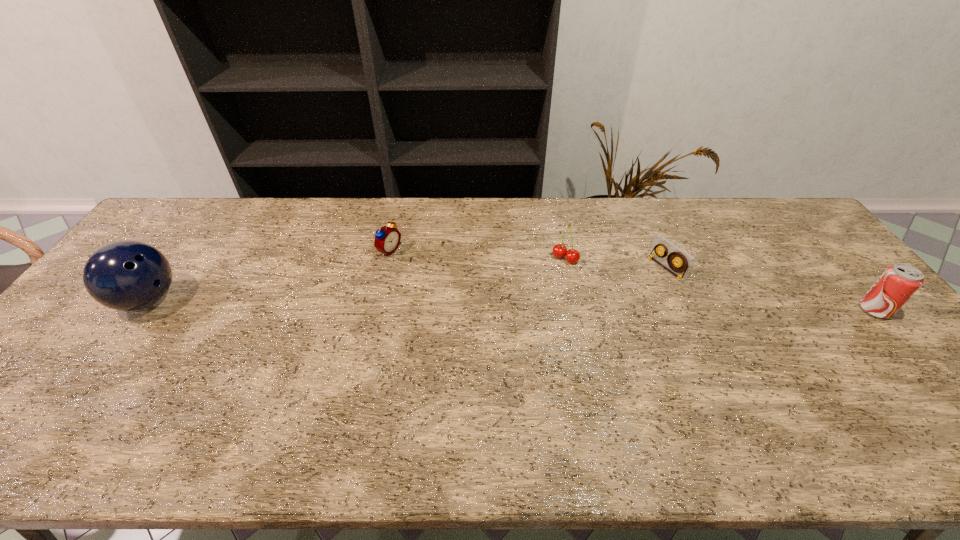
This screenshot has height=540, width=960. I want to click on free spot on the desktop that is between the leftmost object and the rightmost object and is positioned on the front-facing side of the alarm clock, so click(x=505, y=305).

Identify the location of free space on the desktop that is between the leftmost object and the soda can and is positioned with the stems of the cherry pointing upwards. This screenshot has width=960, height=540. (528, 305).

Find the location of a particular element. This screenshot has width=960, height=540. vacant space on the desktop that is between the bowling ball and the fourth shortest object and is positioned at the front of the fourth object from left to right with visible reels is located at coordinates (595, 306).